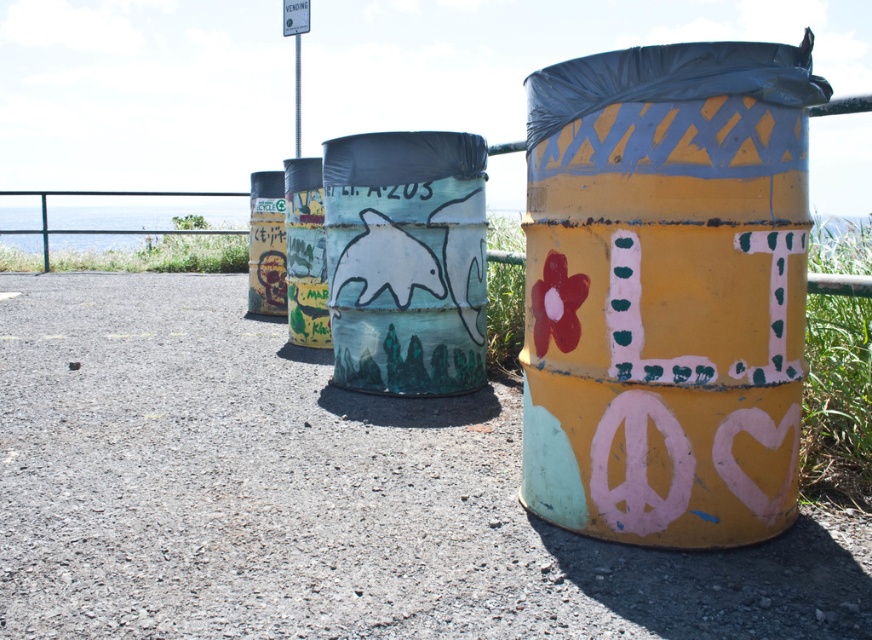
You are trying to determine if the yellow matte trash can at right can fit through a narrow opening that the metallic graffiti can at left can pass through. Based on their widths, which one is wider?

The yellow matte trash can at right is wider than the metallic graffiti can at left according to the description, so it might not fit through the same narrow opening.

From the picture: You are a delivery person trying to place a small package between the yellow matte trash can at right and the matte white dolphin at center. Can you fit it there?

The yellow matte trash can at right is larger than the matte white dolphin at center, so there might be enough space between them to fit a small package.